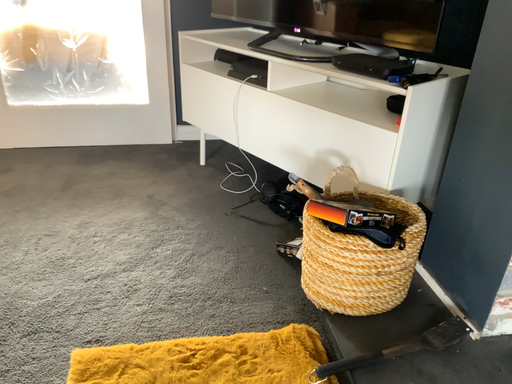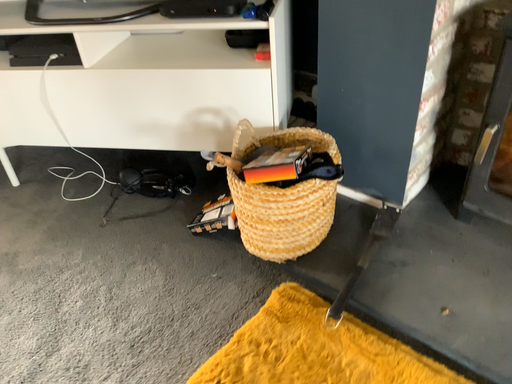
Question: Which way did the camera rotate in the video?

Choices:
 (A) rotated left
 (B) rotated right

Answer: (B)